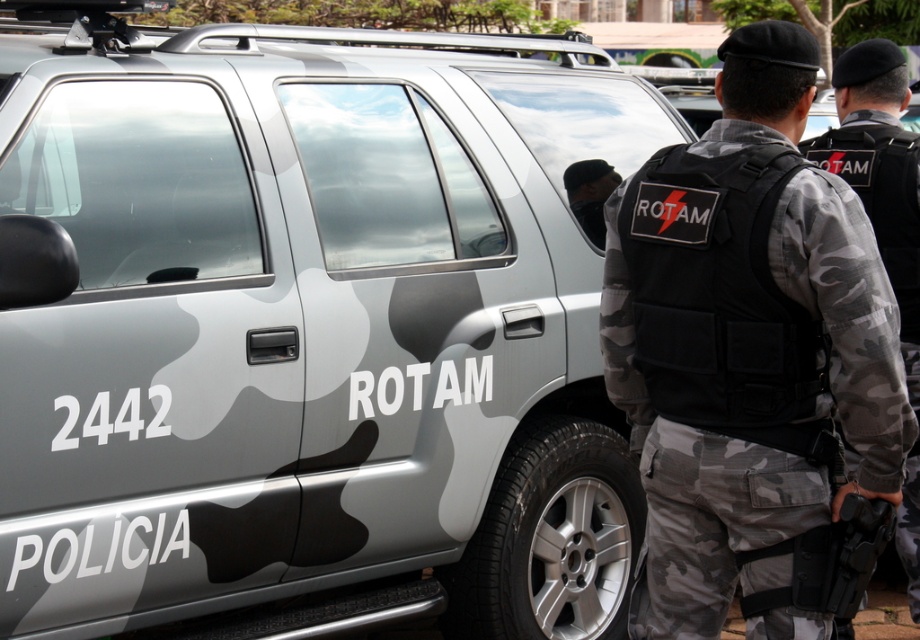
Based on the photo, does black tactical vest at center have a larger size compared to camouflage fabric vest at center?

No, black tactical vest at center is not bigger than camouflage fabric vest at center.

How distant is black tactical vest at center from camouflage fabric vest at center?

They are 4.41 feet apart.

You are a GUI agent. You are given a task and a screenshot of the screen. Output one action in this format:
    pyautogui.click(x=<x>, y=<y>)
    Task: Click on the black tactical vest at center
    
    Given the screenshot: What is the action you would take?
    pyautogui.click(x=745, y=340)

Locate an element on the screen. black tactical vest at center is located at coordinates (745, 340).